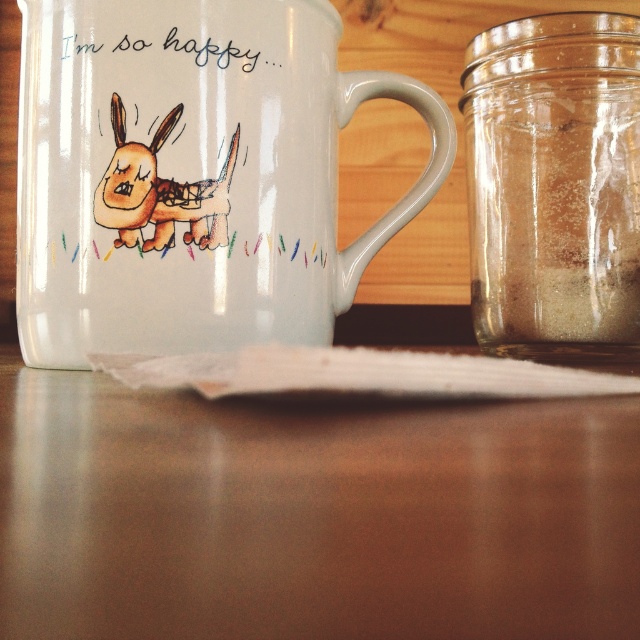
Does matte brown table at center have a greater height compared to transparent glass jar at right?

Incorrect, matte brown table at center's height is not larger of transparent glass jar at right's.

Is matte brown table at center smaller than transparent glass jar at right?

Yes, matte brown table at center is smaller than transparent glass jar at right.

Who is more forward, (42, 372) or (554, 262)?

Positioned in front is point (42, 372).

I want to click on matte brown table at center, so click(310, 513).

Is point (554, 419) closer to viewer compared to point (289, 164)?

Yes, it is in front of point (289, 164).

Is matte brown table at center smaller than white glossy mug at upper center?

Yes.

This screenshot has width=640, height=640. Find the location of `matte brown table at center`. matte brown table at center is located at coordinates (310, 513).

Is white glossy mug at upper center to the right of transparent glass jar at right from the viewer's perspective?

No, white glossy mug at upper center is not to the right of transparent glass jar at right.

Which is below, white glossy mug at upper center or transparent glass jar at right?

transparent glass jar at right is below.

I want to click on white glossy mug at upper center, so click(189, 176).

The width and height of the screenshot is (640, 640). Identify the location of white glossy mug at upper center. (189, 176).